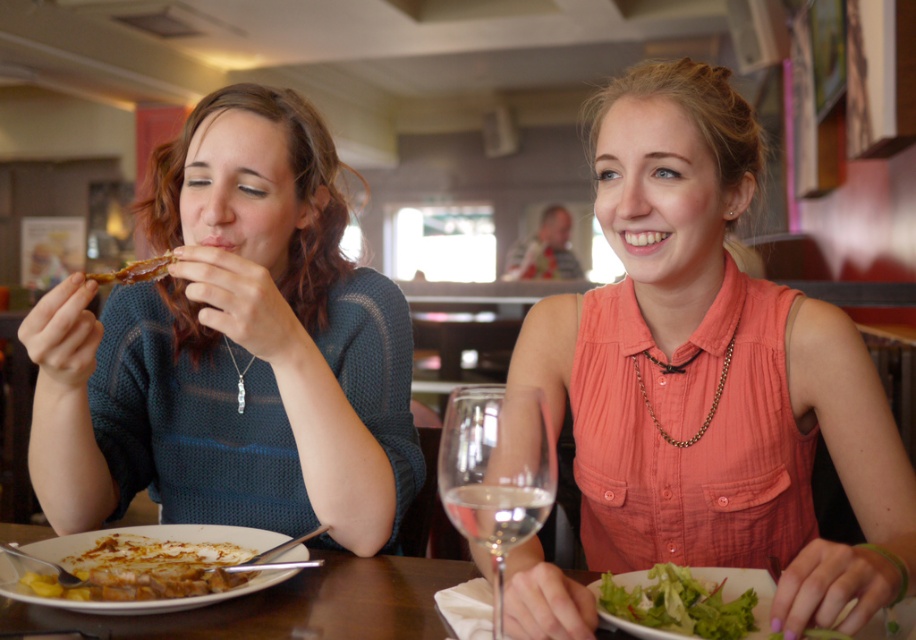
You are a waiter in a restaurant. You see a transparent glass at right and a green leafy salad at lower right. Which item is closer to the left side of the table?

The transparent glass at right is closer to the left side of the table compared to the green leafy salad at lower right because it is positioned to the left of it.